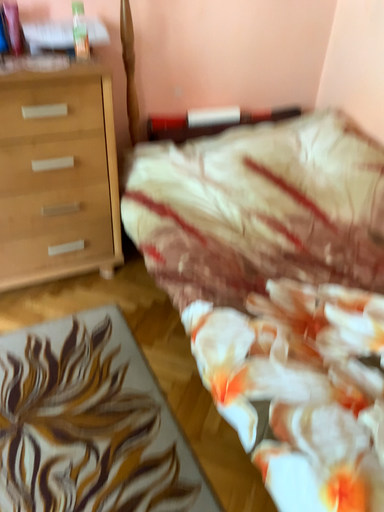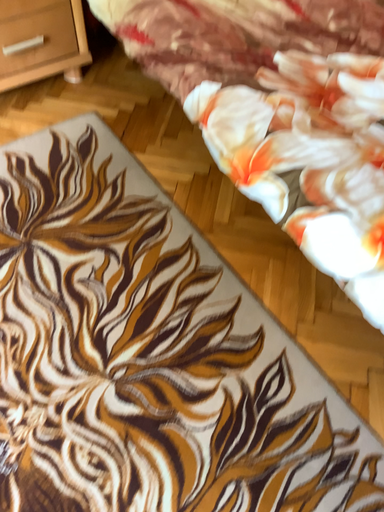
Question: Which way did the camera rotate in the video?

Choices:
 (A) rotated upward
 (B) rotated downward

Answer: (B)